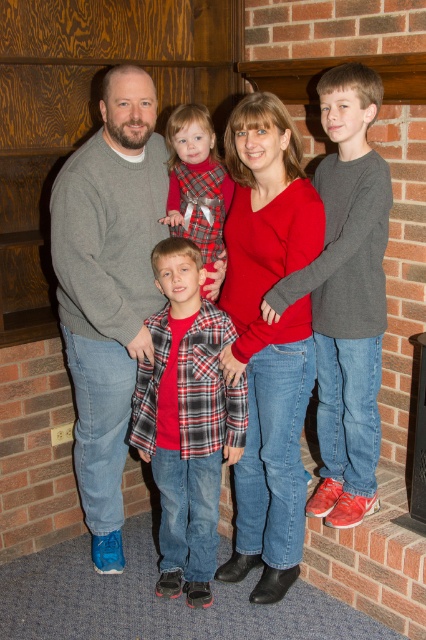
Consider the image. Does matte gray sweater at upper left have a smaller size compared to matte red sweater at center?

Actually, matte gray sweater at upper left might be larger than matte red sweater at center.

This screenshot has height=640, width=426. Find the location of `matte gray sweater at upper left`. matte gray sweater at upper left is located at coordinates (273, 326).

The width and height of the screenshot is (426, 640). Identify the location of matte gray sweater at upper left. (273, 326).

Between matte red sweater at center and plaid fabric dress at center, which one is positioned lower?

matte red sweater at center

Between matte red sweater at center and plaid fabric dress at center, which one appears on the left side from the viewer's perspective?

plaid fabric dress at center is more to the left.

Find the location of a particular element. matte red sweater at center is located at coordinates (268, 337).

Is matte red sweater at center closer to camera compared to plaid flannel shirt at center?

Yes, it is.

Does matte red sweater at center have a lesser height compared to plaid flannel shirt at center?

No, matte red sweater at center is not shorter than plaid flannel shirt at center.

Between point (313, 257) and point (195, 586), which one is positioned behind?

Positioned behind is point (195, 586).

This screenshot has height=640, width=426. What are the coordinates of `matte red sweater at center` in the screenshot? It's located at (268, 337).